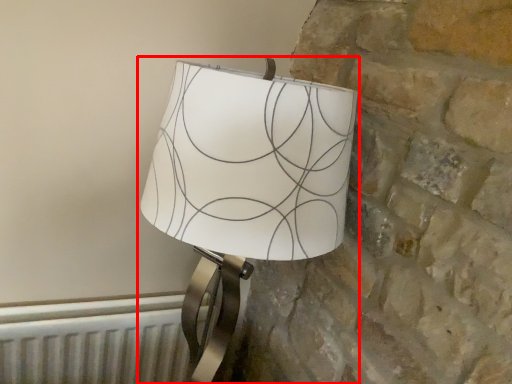
Question: From the image's perspective, what is the correct spatial relationship of lamp (annotated by the red box) in relation to radiator?

Choices:
 (A) above
 (B) below

Answer: (A)